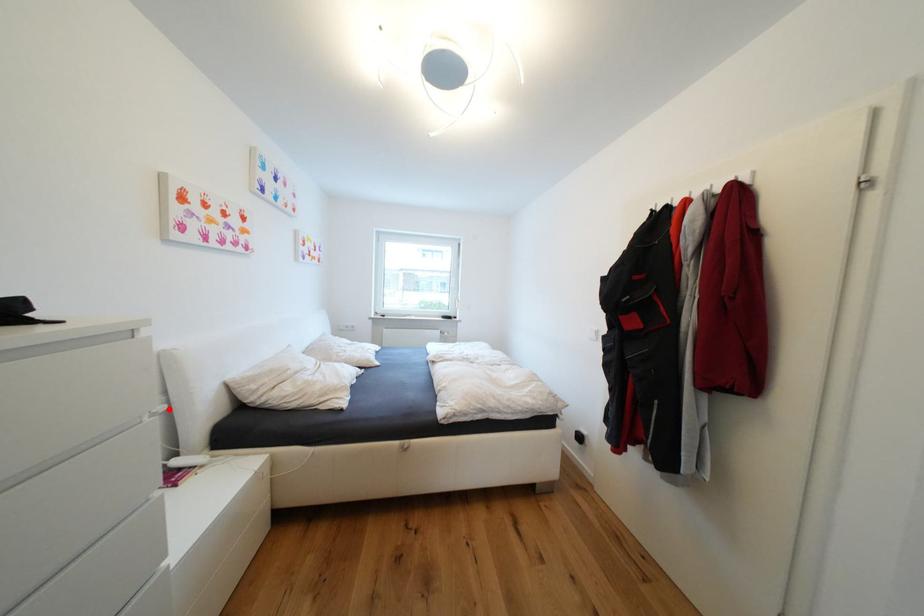
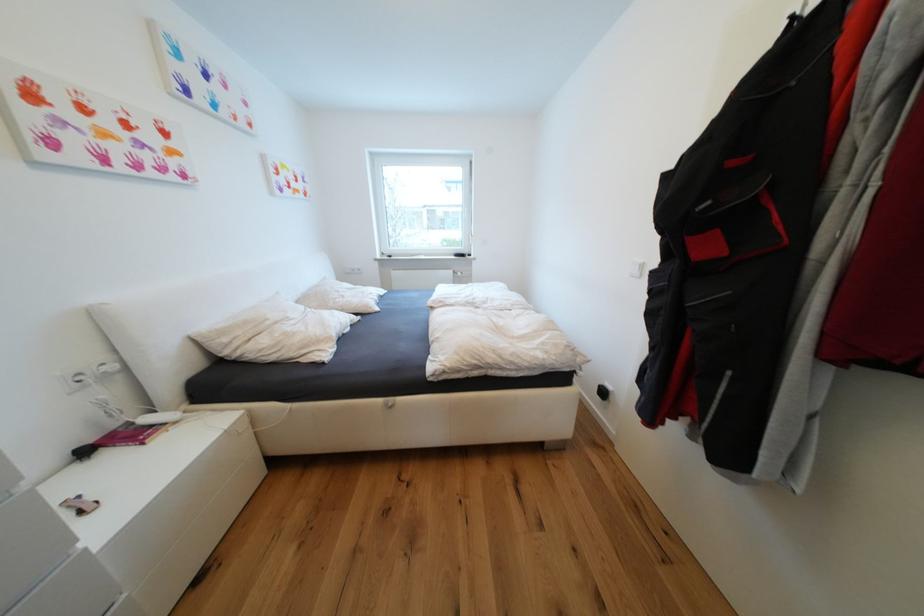
Locate, in the second image, the point that corresponds to the highlighted location in the first image.

(119, 369)